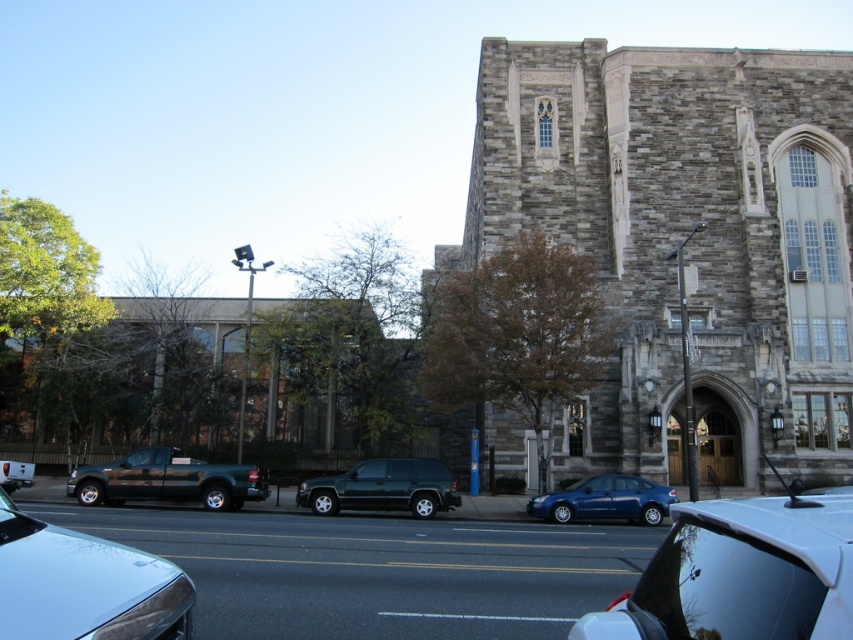
Question: Which object is the closest to the matte black truck at center-left?

Choices:
 (A) matte blue sedan at center
 (B) shiny silver sedan at lower left
 (C) gray stone church at center
 (D) metallic green truck at center-left

Answer: (D)

Question: Which object appears farthest from the camera in this image?

Choices:
 (A) matte black truck at center-left
 (B) shiny dark green suv at center

Answer: (A)

Question: Is metallic green truck at center-left smaller than matte blue sedan at center?

Choices:
 (A) yes
 (B) no

Answer: (B)

Question: Where is shiny silver sedan at lower left located in relation to shiny dark green suv at center in the image?

Choices:
 (A) left
 (B) right

Answer: (A)

Question: Can you confirm if metallic green truck at center-left is positioned below matte blue sedan at center?

Choices:
 (A) no
 (B) yes

Answer: (A)

Question: Which of these objects is positioned farthest from the matte black truck at center-left?

Choices:
 (A) metallic green truck at center-left
 (B) shiny dark green suv at center
 (C) shiny silver sedan at lower left
 (D) white glossy car at center

Answer: (D)